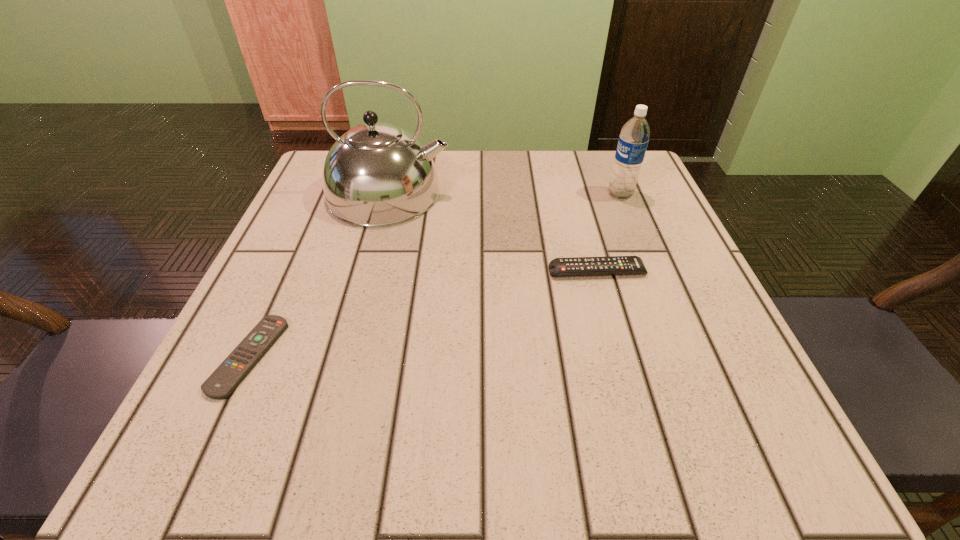
The width and height of the screenshot is (960, 540). In order to click on blank area in the image that satisfies the following two spatial constraints: 1. from the spout of the tallest object; 2. on the back side of the farther remote control in this screenshot , I will do `click(369, 271)`.

Locate an element on the screen. This screenshot has width=960, height=540. blank area in the image that satisfies the following two spatial constraints: 1. from the spout of the tallest object; 2. on the right side of the third shortest object is located at coordinates (389, 194).

Where is `vacant space that satisfies the following two spatial constraints: 1. on the back side of the water bottle; 2. on the left side of the right remote control`? vacant space that satisfies the following two spatial constraints: 1. on the back side of the water bottle; 2. on the left side of the right remote control is located at coordinates (576, 194).

Locate an element on the screen. Image resolution: width=960 pixels, height=540 pixels. vacant area that satisfies the following two spatial constraints: 1. from the spout of the tallest object; 2. on the front side of the nearer remote control is located at coordinates (346, 356).

Identify the location of free region that satisfies the following two spatial constraints: 1. on the back side of the right remote control; 2. on the right side of the second tallest object. The image size is (960, 540). (576, 194).